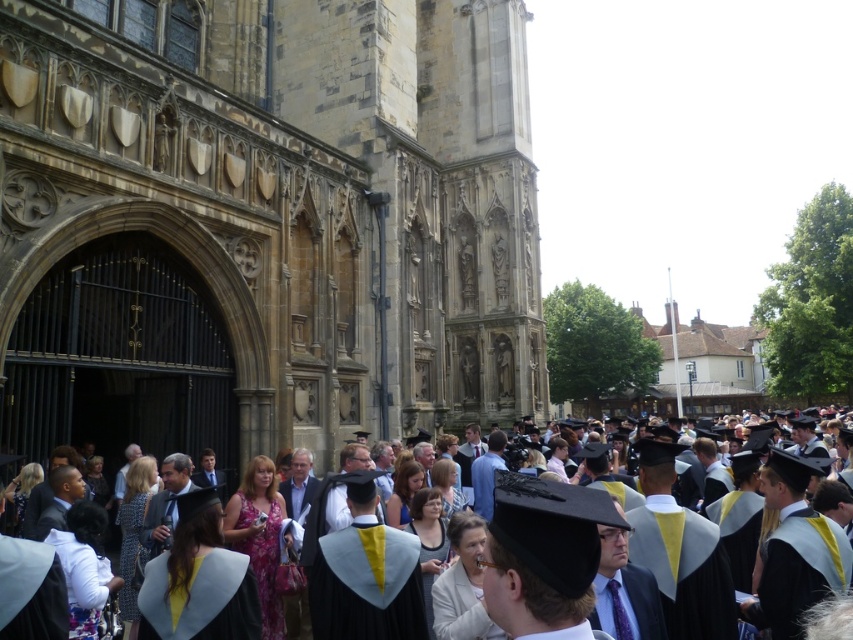
Question: Considering the real-world distances, which object is farthest from the brown stone church at center?

Choices:
 (A) matte black graduation gown at center
 (B) light blue felt graduation gown at lower center

Answer: (B)

Question: Does brown stone church at center have a lesser width compared to matte black graduation gown at center?

Choices:
 (A) no
 (B) yes

Answer: (A)

Question: Estimate the real-world distances between objects in this image. Which object is farther from the brown stone church at center?

Choices:
 (A) light blue felt graduation gown at lower center
 (B) matte black graduation gown at center

Answer: (A)

Question: Which of the following is the farthest from the observer?

Choices:
 (A) (413, 104)
 (B) (254, 595)
 (C) (834, 586)

Answer: (A)

Question: Is brown stone church at center in front of matte black graduation gown at center?

Choices:
 (A) yes
 (B) no

Answer: (B)

Question: Is brown stone church at center positioned before light blue felt graduation gown at lower center?

Choices:
 (A) yes
 (B) no

Answer: (B)